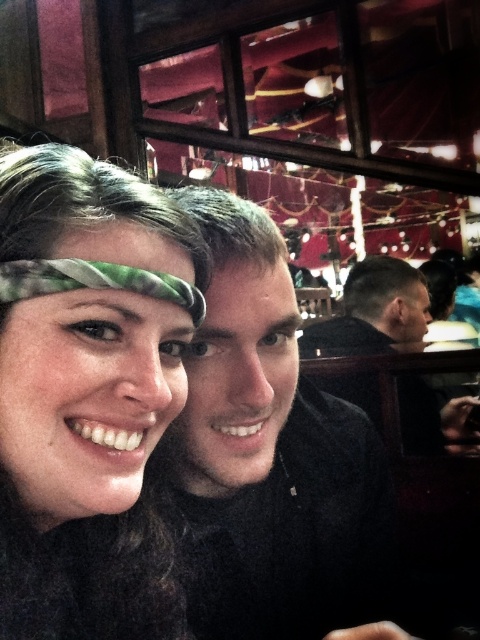
Between matte green headband at center and black matte shirt at center, which one is positioned higher?

matte green headband at center is above.

The height and width of the screenshot is (640, 480). Describe the element at coordinates (88, 394) in the screenshot. I see `matte green headband at center` at that location.

Is point (172, 212) positioned in front of point (225, 547)?

Yes.

Where is `matte green headband at center`? matte green headband at center is located at coordinates (88, 394).